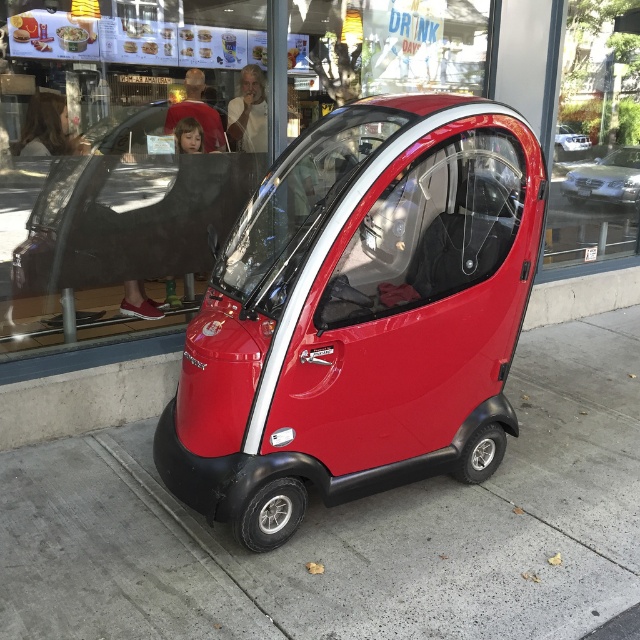
Question: Among these objects, which one is farthest from the camera?

Choices:
 (A) glossy red car at center
 (B) glossy concrete pavement at lower center
 (C) metallic silver car at center
 (D) satin silver sedan at center

Answer: (D)

Question: Which is nearer to the satin silver sedan at center?

Choices:
 (A) glossy red car at center
 (B) glossy concrete pavement at lower center

Answer: (B)

Question: Can you confirm if glossy red car at center is bigger than glossy concrete pavement at lower center?

Choices:
 (A) no
 (B) yes

Answer: (A)

Question: Which point is farther to the camera?

Choices:
 (A) glossy concrete pavement at lower center
 (B) metallic silver car at center
 (C) satin silver sedan at center

Answer: (C)

Question: In this image, where is satin silver sedan at center located relative to metallic silver car at center?

Choices:
 (A) right
 (B) left

Answer: (A)

Question: Is glossy red car at center wider than metallic silver car at center?

Choices:
 (A) yes
 (B) no

Answer: (A)